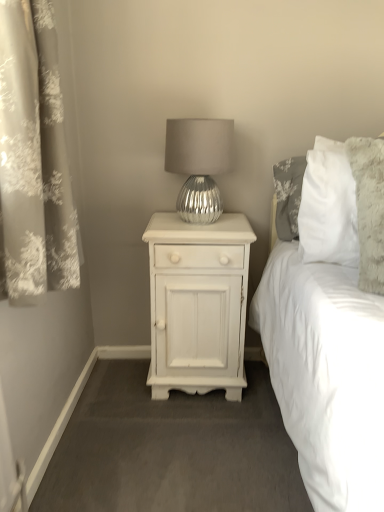
Question: From a real-world perspective, does white painted wood nightstand at center stand above silver metallic lamp at center?

Choices:
 (A) no
 (B) yes

Answer: (A)

Question: Is white painted wood nightstand at center looking in the opposite direction of silver metallic lamp at center?

Choices:
 (A) no
 (B) yes

Answer: (A)

Question: Is the position of white painted wood nightstand at center more distant than that of silver metallic lamp at center?

Choices:
 (A) yes
 (B) no

Answer: (A)

Question: Is white painted wood nightstand at center not close to silver metallic lamp at center?

Choices:
 (A) no
 (B) yes

Answer: (A)

Question: From the image's perspective, is white painted wood nightstand at center beneath silver metallic lamp at center?

Choices:
 (A) no
 (B) yes

Answer: (B)

Question: From the image's perspective, is silvery floral curtain at left located above or below white painted wood nightstand at center?

Choices:
 (A) below
 (B) above

Answer: (B)

Question: Is silvery floral curtain at left in front of or behind white painted wood nightstand at center in the image?

Choices:
 (A) front
 (B) behind

Answer: (A)

Question: Based on their positions, is silvery floral curtain at left located to the left or right of white painted wood nightstand at center?

Choices:
 (A) left
 (B) right

Answer: (A)

Question: Do you think silvery floral curtain at left is within white painted wood nightstand at center, or outside of it?

Choices:
 (A) outside
 (B) inside

Answer: (A)

Question: Is silver metallic lamp at center to the left or to the right of white painted wood nightstand at center in the image?

Choices:
 (A) right
 (B) left

Answer: (A)

Question: Is point (173, 125) positioned closer to the camera than point (200, 232)?

Choices:
 (A) farther
 (B) closer

Answer: (B)

Question: From the image's perspective, is silver metallic lamp at center above or below white painted wood nightstand at center?

Choices:
 (A) above
 (B) below

Answer: (A)

Question: Looking at their shapes, would you say silver metallic lamp at center is wider or thinner than white painted wood nightstand at center?

Choices:
 (A) thin
 (B) wide

Answer: (A)

Question: In terms of height, does silver metallic lamp at center look taller or shorter compared to silvery floral curtain at left?

Choices:
 (A) short
 (B) tall

Answer: (A)

Question: From a real-world perspective, is silver metallic lamp at center physically located above or below silvery floral curtain at left?

Choices:
 (A) above
 (B) below

Answer: (B)